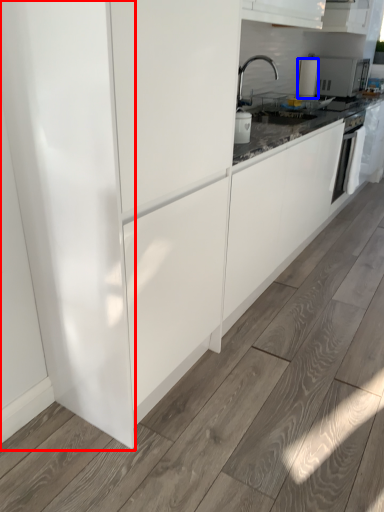
Question: Which point is further to the camera, glass door (highlighted by a red box) or kitchen appliance (highlighted by a blue box)?

Choices:
 (A) glass door
 (B) kitchen appliance

Answer: (B)